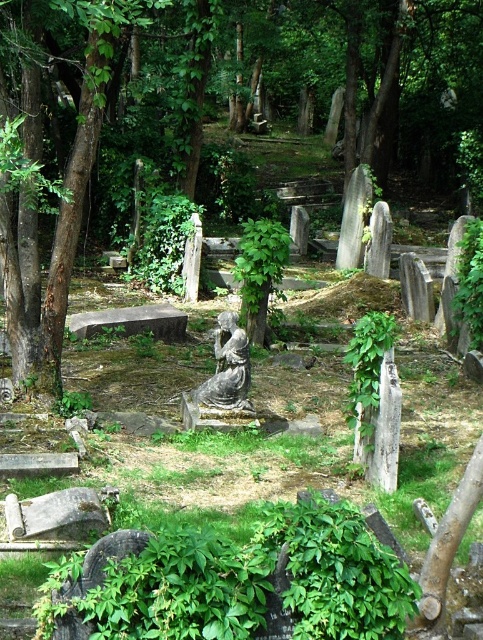
Consider the image. Who is shorter, brown wood tree at center or gray stone statue at center?

With less height is gray stone statue at center.

Is point (114, 184) positioned before point (221, 420)?

That is False.

You are a GUI agent. You are given a task and a screenshot of the screen. Output one action in this format:
    pyautogui.click(x=<x>, y=<y>)
    Task: Click on the brown wood tree at center
    
    Given the screenshot: What is the action you would take?
    pyautogui.click(x=233, y=116)